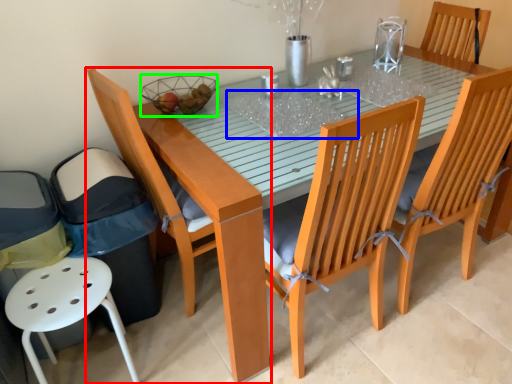
Question: Considering the real-world distances, which object is farthest from chair (highlighted by a red box)? glass table (highlighted by a blue box) or basket (highlighted by a green box)?

Choices:
 (A) glass table
 (B) basket

Answer: (A)